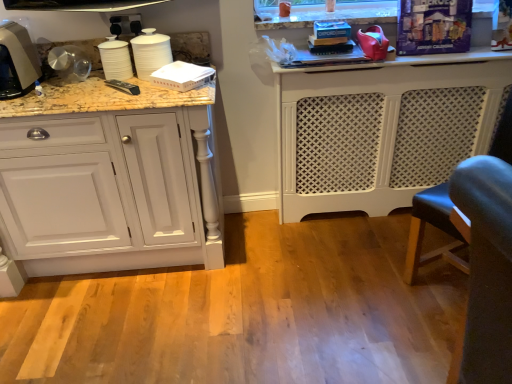
Where is `white glossy cups at upper left, marked as the third appliance in a right-to-left arrangement`? The image size is (512, 384). white glossy cups at upper left, marked as the third appliance in a right-to-left arrangement is located at coordinates (150, 52).

Identify the location of rubberized red shoe at upper right, which is the 4th appliance from left to right. The height and width of the screenshot is (384, 512). (373, 43).

Image resolution: width=512 pixels, height=384 pixels. Describe the element at coordinates (182, 76) in the screenshot. I see `white paper napkin at upper left, the second appliance in the right-to-left sequence` at that location.

The image size is (512, 384). Find the location of `matte gray cabinet at left, acting as the first cabinetry starting from the left`. matte gray cabinet at left, acting as the first cabinetry starting from the left is located at coordinates (110, 183).

Looking at this image, is metallic silver kettle at left to the right of matte gray cabinet at left, acting as the first cabinetry starting from the left, from the viewer's perspective?

No.

From the picture: Is metallic silver kettle at left positioned behind matte gray cabinet at left, arranged as the 2th cabinetry when viewed from the right?

Yes, metallic silver kettle at left is further from the viewer.

What's the angular difference between metallic silver kettle at left and matte gray cabinet at left, arranged as the 2th cabinetry when viewed from the right,'s facing directions?

The angle between the facing direction of metallic silver kettle at left and the facing direction of matte gray cabinet at left, arranged as the 2th cabinetry when viewed from the right, is 2.02 degrees.

From the image's perspective, is metallic silver kettle at left positioned above or below matte gray cabinet at left, acting as the first cabinetry starting from the left?

metallic silver kettle at left is above matte gray cabinet at left, acting as the first cabinetry starting from the left.

Considering the relative sizes of white textured radiator at center, which appears as the first cabinetry when viewed from the right, and white matte cups at left, marked as the fourth appliance in a right-to-left arrangement, in the image provided, is white textured radiator at center, which appears as the first cabinetry when viewed from the right, wider than white matte cups at left, marked as the fourth appliance in a right-to-left arrangement,?

Correct, the width of white textured radiator at center, which appears as the first cabinetry when viewed from the right, exceeds that of white matte cups at left, marked as the fourth appliance in a right-to-left arrangement.

In the scene shown: Who is smaller, white textured radiator at center, which is counted as the second cabinetry, starting from the left, or white matte cups at left, marked as the fourth appliance in a right-to-left arrangement?

white matte cups at left, marked as the fourth appliance in a right-to-left arrangement.

From a real-world perspective, does white textured radiator at center, which appears as the first cabinetry when viewed from the right, sit lower than white matte cups at left, marked as the 1th appliance in a left-to-right arrangement?

Correct, in the physical world, white textured radiator at center, which appears as the first cabinetry when viewed from the right, is lower than white matte cups at left, marked as the 1th appliance in a left-to-right arrangement.

Between white textured radiator at center, which is counted as the second cabinetry, starting from the left, and white matte cups at left, marked as the fourth appliance in a right-to-left arrangement, which one appears on the left side from the viewer's perspective?

white matte cups at left, marked as the fourth appliance in a right-to-left arrangement.

Is rubberized red shoe at upper right, which ranks as the 1th appliance in right-to-left order, positioned far away from white paper napkin at upper left, the second appliance in the right-to-left sequence?

That's not correct — rubberized red shoe at upper right, which ranks as the 1th appliance in right-to-left order, is a little close to white paper napkin at upper left, the second appliance in the right-to-left sequence.

Is rubberized red shoe at upper right, which is the 4th appliance from left to right, not inside white paper napkin at upper left, the 3th appliance viewed from the left?

Indeed, rubberized red shoe at upper right, which is the 4th appliance from left to right, is completely outside white paper napkin at upper left, the 3th appliance viewed from the left.

From a real-world perspective, is rubberized red shoe at upper right, which is the 4th appliance from left to right, physically located above or below white paper napkin at upper left, the second appliance in the right-to-left sequence?

In terms of real-world spatial position, rubberized red shoe at upper right, which is the 4th appliance from left to right, is above white paper napkin at upper left, the second appliance in the right-to-left sequence.

Can you confirm if rubberized red shoe at upper right, which is the 4th appliance from left to right, is thinner than white paper napkin at upper left, the 3th appliance viewed from the left?

Yes.

From the image's perspective, which one is positioned higher, white paper napkin at upper left, the second appliance in the right-to-left sequence, or white glossy cups at upper left, the 2th appliance positioned from the left?

From the image's view, white glossy cups at upper left, the 2th appliance positioned from the left, is above.

Find the location of a particular element. The height and width of the screenshot is (384, 512). the 1st appliance behind the white paper napkin at upper left, the second appliance in the right-to-left sequence is located at coordinates (150, 52).

Can you confirm if white paper napkin at upper left, the second appliance in the right-to-left sequence, is positioned to the left of white glossy cups at upper left, marked as the third appliance in a right-to-left arrangement?

In fact, white paper napkin at upper left, the second appliance in the right-to-left sequence, is to the right of white glossy cups at upper left, marked as the third appliance in a right-to-left arrangement.

Is white glossy cups at upper left, the 2th appliance positioned from the left, in front of or behind white paper napkin at upper left, the second appliance in the right-to-left sequence, in the image?

In the image, white glossy cups at upper left, the 2th appliance positioned from the left, appears behind white paper napkin at upper left, the second appliance in the right-to-left sequence.

Is white glossy cups at upper left, marked as the third appliance in a right-to-left arrangement, positioned far away from white paper napkin at upper left, the second appliance in the right-to-left sequence?

No, white glossy cups at upper left, marked as the third appliance in a right-to-left arrangement, is not far from white paper napkin at upper left, the second appliance in the right-to-left sequence.

Is white glossy cups at upper left, marked as the third appliance in a right-to-left arrangement, turned away from white paper napkin at upper left, the 3th appliance viewed from the left?

No, white glossy cups at upper left, marked as the third appliance in a right-to-left arrangement, is not facing the opposite direction of white paper napkin at upper left, the 3th appliance viewed from the left.

Considering the sizes of objects white glossy cups at upper left, the 2th appliance positioned from the left, and white paper napkin at upper left, the 3th appliance viewed from the left, in the image provided, who is thinner, white glossy cups at upper left, the 2th appliance positioned from the left, or white paper napkin at upper left, the 3th appliance viewed from the left,?

white glossy cups at upper left, the 2th appliance positioned from the left, is thinner.

In the scene shown: From a real-world perspective, relative to metallic silver kettle at left, is white glossy cups at upper left, the 2th appliance positioned from the left, vertically above or below?

From a real-world perspective, white glossy cups at upper left, the 2th appliance positioned from the left, is physically below metallic silver kettle at left.

Can you tell me how much white glossy cups at upper left, marked as the third appliance in a right-to-left arrangement, and metallic silver kettle at left differ in facing direction?

0.00222 degrees.

From the image's perspective, relative to metallic silver kettle at left, is white glossy cups at upper left, marked as the third appliance in a right-to-left arrangement, above or below?

Clearly, from the image's perspective, white glossy cups at upper left, marked as the third appliance in a right-to-left arrangement, is above metallic silver kettle at left.

Does white matte cups at left, marked as the fourth appliance in a right-to-left arrangement, come behind matte gray cabinet at left, acting as the first cabinetry starting from the left?

Yes, white matte cups at left, marked as the fourth appliance in a right-to-left arrangement, is further from the camera.

Is matte gray cabinet at left, acting as the first cabinetry starting from the left, inside white matte cups at left, marked as the fourth appliance in a right-to-left arrangement?

That's incorrect, matte gray cabinet at left, acting as the first cabinetry starting from the left, is not inside white matte cups at left, marked as the fourth appliance in a right-to-left arrangement.

Does white matte cups at left, marked as the fourth appliance in a right-to-left arrangement, appear on the left side of matte gray cabinet at left, acting as the first cabinetry starting from the left?

Incorrect, white matte cups at left, marked as the fourth appliance in a right-to-left arrangement, is not on the left side of matte gray cabinet at left, acting as the first cabinetry starting from the left.

From the image's perspective, is white matte cups at left, marked as the 1th appliance in a left-to-right arrangement, above or below matte gray cabinet at left, arranged as the 2th cabinetry when viewed from the right?

Clearly, from the image's perspective, white matte cups at left, marked as the 1th appliance in a left-to-right arrangement, is above matte gray cabinet at left, arranged as the 2th cabinetry when viewed from the right.

What are the coordinates of `home appliance that is above the matte gray cabinet at left, acting as the first cabinetry starting from the left (from the image's perspective)` in the screenshot? It's located at (17, 61).

Where is `the 3rd appliance directly above the white textured radiator at center, which appears as the first cabinetry when viewed from the right (from a real-world perspective)`? The height and width of the screenshot is (384, 512). the 3rd appliance directly above the white textured radiator at center, which appears as the first cabinetry when viewed from the right (from a real-world perspective) is located at coordinates (115, 59).

When comparing their distances from white matte cups at left, marked as the 1th appliance in a left-to-right arrangement, does matte gray cabinet at left, acting as the first cabinetry starting from the left, or white glossy cups at upper left, the 2th appliance positioned from the left, seem further?

matte gray cabinet at left, acting as the first cabinetry starting from the left, is positioned further to the anchor white matte cups at left, marked as the 1th appliance in a left-to-right arrangement.

Considering their positions, is white glossy cups at upper left, marked as the third appliance in a right-to-left arrangement, positioned further to white matte cups at left, marked as the fourth appliance in a right-to-left arrangement, than white paper napkin at upper left, the 3th appliance viewed from the left?

white paper napkin at upper left, the 3th appliance viewed from the left, lies further to white matte cups at left, marked as the fourth appliance in a right-to-left arrangement, than the other object.

From the picture: When comparing their distances from matte gray cabinet at left, acting as the first cabinetry starting from the left, does rubberized red shoe at upper right, which is the 4th appliance from left to right, or white glossy cups at upper left, marked as the third appliance in a right-to-left arrangement, seem closer?

Based on the image, white glossy cups at upper left, marked as the third appliance in a right-to-left arrangement, appears to be nearer to matte gray cabinet at left, acting as the first cabinetry starting from the left.

Considering their positions, is rubberized red shoe at upper right, which is the 4th appliance from left to right, positioned further to white matte cups at left, marked as the 1th appliance in a left-to-right arrangement, than white textured radiator at center, which is counted as the second cabinetry, starting from the left?

Among the two, white textured radiator at center, which is counted as the second cabinetry, starting from the left, is located further to white matte cups at left, marked as the 1th appliance in a left-to-right arrangement.

From the image, which object appears to be farther from white paper napkin at upper left, the 3th appliance viewed from the left, white matte cups at left, marked as the fourth appliance in a right-to-left arrangement, or metallic silver kettle at left?

Among the two, metallic silver kettle at left is located further to white paper napkin at upper left, the 3th appliance viewed from the left.

Looking at the image, which one is located closer to white matte cups at left, marked as the 1th appliance in a left-to-right arrangement, white glossy cups at upper left, marked as the third appliance in a right-to-left arrangement, or rubberized red shoe at upper right, which ranks as the 1th appliance in right-to-left order?

Based on the image, white glossy cups at upper left, marked as the third appliance in a right-to-left arrangement, appears to be nearer to white matte cups at left, marked as the 1th appliance in a left-to-right arrangement.

Consider the image. When comparing their distances from matte gray cabinet at left, acting as the first cabinetry starting from the left, does white matte cups at left, marked as the 1th appliance in a left-to-right arrangement, or rubberized red shoe at upper right, which ranks as the 1th appliance in right-to-left order, seem further?

Among the two, rubberized red shoe at upper right, which ranks as the 1th appliance in right-to-left order, is located further to matte gray cabinet at left, acting as the first cabinetry starting from the left.

Which object lies nearer to the anchor point rubberized red shoe at upper right, which ranks as the 1th appliance in right-to-left order, white textured radiator at center, which appears as the first cabinetry when viewed from the right, or metallic silver kettle at left?

white textured radiator at center, which appears as the first cabinetry when viewed from the right, is closer to rubberized red shoe at upper right, which ranks as the 1th appliance in right-to-left order.

The image size is (512, 384). What are the coordinates of `cabinetry between metallic silver kettle at left and white paper napkin at upper left, the second appliance in the right-to-left sequence, from left to right` in the screenshot? It's located at (110, 183).

This screenshot has height=384, width=512. Find the location of `home appliance between white glossy cups at upper left, marked as the third appliance in a right-to-left arrangement, and matte gray cabinet at left, arranged as the 2th cabinetry when viewed from the right, vertically`. home appliance between white glossy cups at upper left, marked as the third appliance in a right-to-left arrangement, and matte gray cabinet at left, arranged as the 2th cabinetry when viewed from the right, vertically is located at coordinates (17, 61).

At what (x,y) coordinates should I click in order to perform the action: click on appliance between white matte cups at left, marked as the fourth appliance in a right-to-left arrangement, and white paper napkin at upper left, the 3th appliance viewed from the left, from left to right. Please return your answer as a coordinate pair (x, y). The width and height of the screenshot is (512, 384). Looking at the image, I should click on (150, 52).

Locate an element on the screen. The image size is (512, 384). appliance located between metallic silver kettle at left and white glossy cups at upper left, marked as the third appliance in a right-to-left arrangement, in the left-right direction is located at coordinates (115, 59).